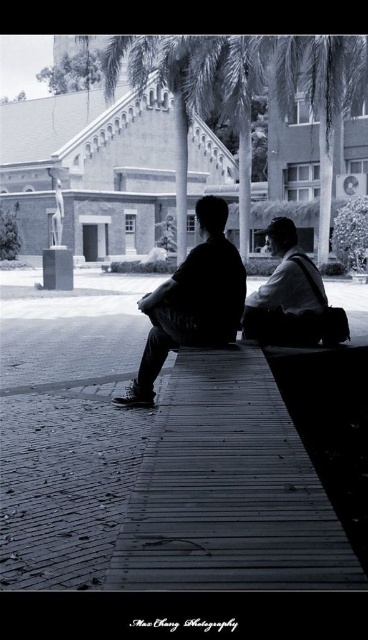
Question: Which object is closer to the camera taking this photo?

Choices:
 (A) black matte jacket at center
 (B) matte black jacket at center

Answer: (A)

Question: From the image, what is the correct spatial relationship of black matte jacket at center in relation to matte black jacket at center?

Choices:
 (A) below
 (B) above

Answer: (A)

Question: Is black matte jacket at center to the right of matte black jacket at center from the viewer's perspective?

Choices:
 (A) yes
 (B) no

Answer: (B)

Question: Which point is farther from the camera taking this photo?

Choices:
 (A) pyautogui.click(x=289, y=321)
 (B) pyautogui.click(x=139, y=308)

Answer: (A)

Question: Is black matte jacket at center bigger than matte black jacket at center?

Choices:
 (A) yes
 (B) no

Answer: (A)